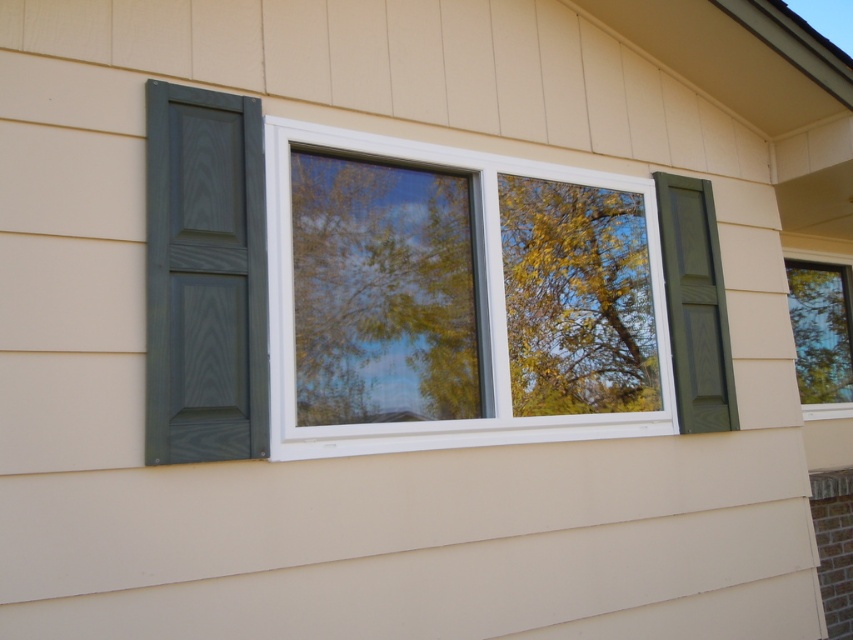
Question: Among these points, which one is nearest to the camera?

Choices:
 (A) (440, 321)
 (B) (711, 420)
 (C) (805, 268)
 (D) (172, 333)

Answer: (D)

Question: Among these objects, which one is farthest from the camera?

Choices:
 (A) green wood shutter at right
 (B) green wood tree at center
 (C) transparent glass window at center

Answer: (C)

Question: Is green wood shutter at right thinner than transparent glass window at center?

Choices:
 (A) no
 (B) yes

Answer: (B)

Question: Observing the image, what is the correct spatial positioning of green wood tree at center in reference to green wood shutter at right?

Choices:
 (A) left
 (B) right

Answer: (A)

Question: From the image, what is the correct spatial relationship of green wood tree at center in relation to green wood shutter at right?

Choices:
 (A) right
 (B) left

Answer: (B)

Question: Which point is closer to the camera taking this photo?

Choices:
 (A) (306, 154)
 (B) (825, 362)

Answer: (A)